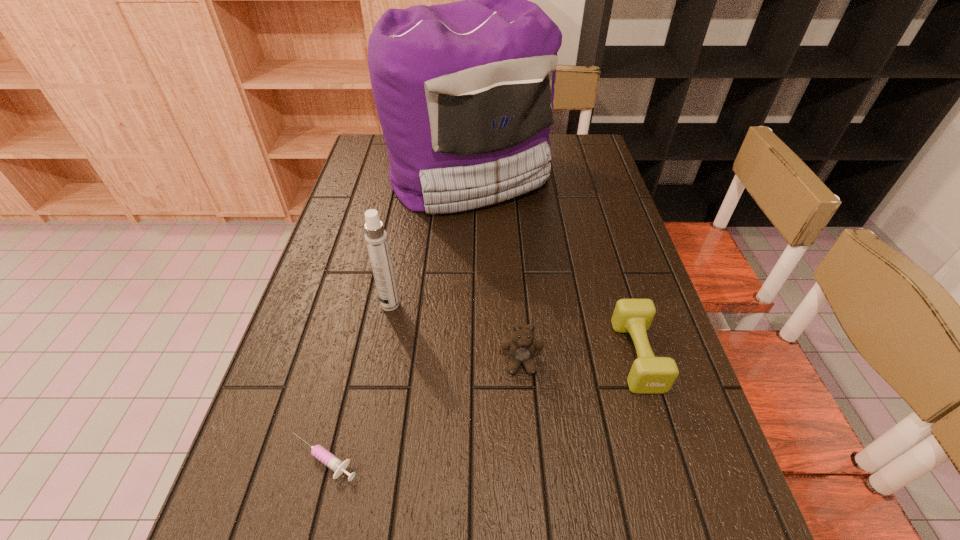
Locate an element on the screen. The image size is (960, 540). vacant space located on the back of the fourth shortest object is located at coordinates (401, 246).

Where is `vacant space situated 0.080m on the face of the teddy bear`? vacant space situated 0.080m on the face of the teddy bear is located at coordinates (525, 413).

The height and width of the screenshot is (540, 960). I want to click on free space located 0.120m on the left of the rightmost object, so click(x=564, y=356).

The width and height of the screenshot is (960, 540). I want to click on free region located 0.280m on the right of the nearest object, so click(515, 458).

Where is `object at the far edge`? The image size is (960, 540). object at the far edge is located at coordinates (464, 91).

Locate an element on the screen. The width and height of the screenshot is (960, 540). backpack located in the left edge section of the desktop is located at coordinates (464, 91).

Locate an element on the screen. The image size is (960, 540). syringe present at the left edge is located at coordinates (319, 452).

Locate an element on the screen. The height and width of the screenshot is (540, 960). object located at the right edge is located at coordinates (649, 375).

Locate an element on the screen. The height and width of the screenshot is (540, 960). object that is at the far left corner is located at coordinates (464, 91).

Find the location of a particular element. Image resolution: width=960 pixels, height=540 pixels. free space at the left edge is located at coordinates (379, 213).